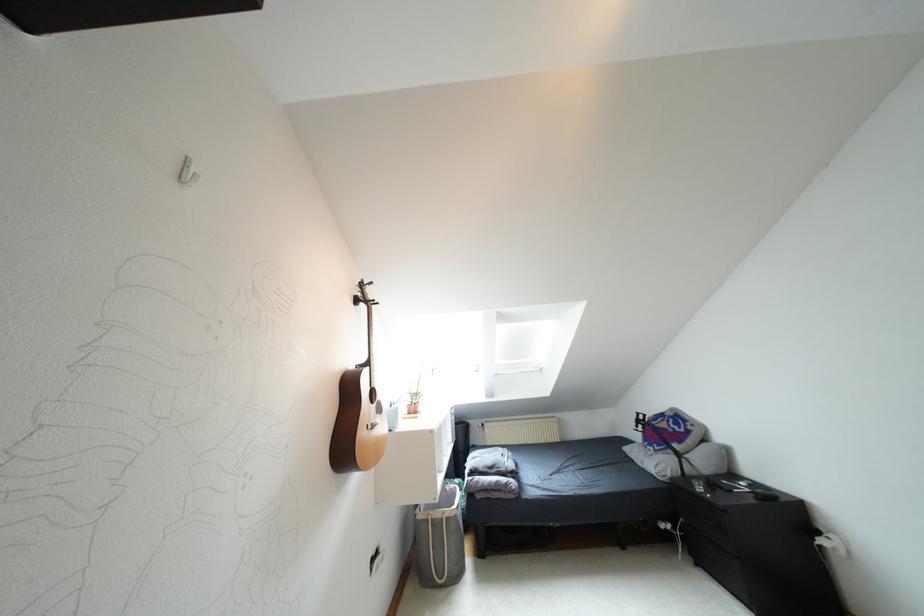
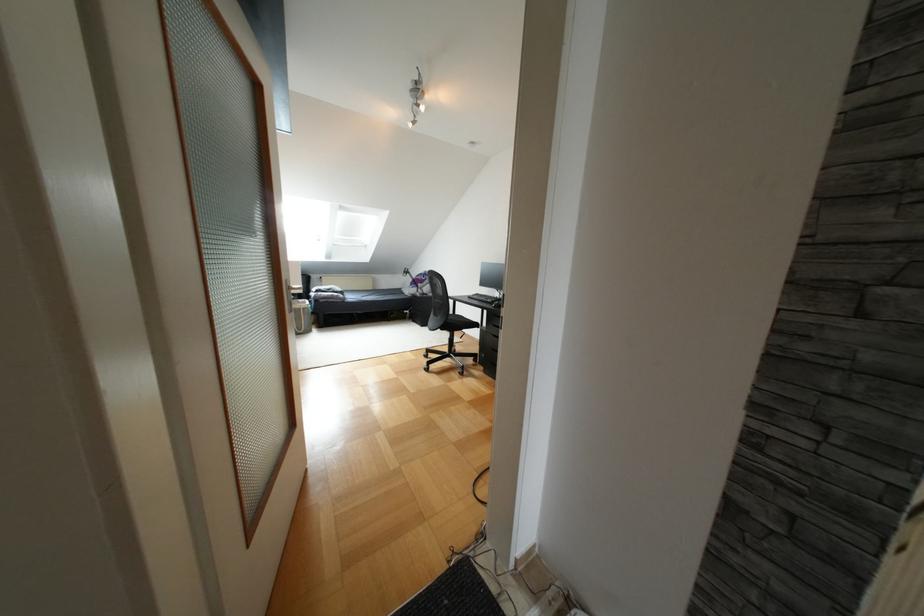
Where in the second image is the point corresponding to [456,573] from the first image?

(309, 330)